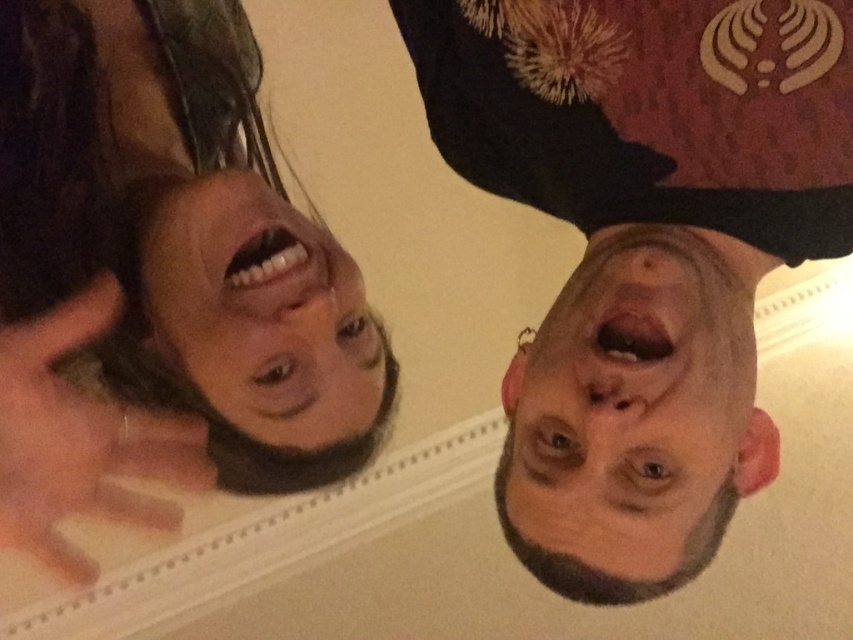
You are a photographer trying to capture a portrait of the dark brown hair at upper left and the bald head at lower right. Based on their positions, which one is located to the left side of the other?

The dark brown hair at upper left is positioned on the left side of bald head at lower right.

You are looking at a photo where two people are positioned such that their faces are upside down. You notice the dark brown hair at upper right and dark brown hair at upper left. Which of these two dark brown hairs is shorter in the photo?

The dark brown hair at upper right has a lesser height compared to dark brown hair at upper left, so it is shorter.